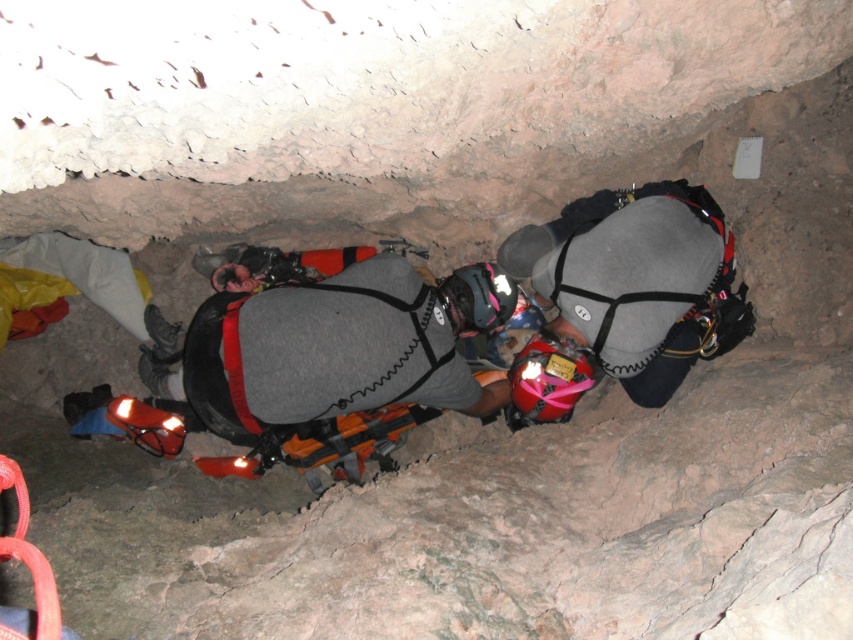
Question: Which point is closer to the camera?

Choices:
 (A) (392, 326)
 (B) (660, 387)

Answer: (A)

Question: Is gray matte vest at center above gray fabric helmet at center?

Choices:
 (A) no
 (B) yes

Answer: (A)

Question: Does gray matte vest at center come in front of gray fabric helmet at center?

Choices:
 (A) yes
 (B) no

Answer: (A)

Question: Is gray matte vest at center further to the viewer compared to gray fabric helmet at center?

Choices:
 (A) no
 (B) yes

Answer: (A)

Question: Which point is farther to the camera?

Choices:
 (A) (x=500, y=296)
 (B) (x=577, y=259)

Answer: (A)